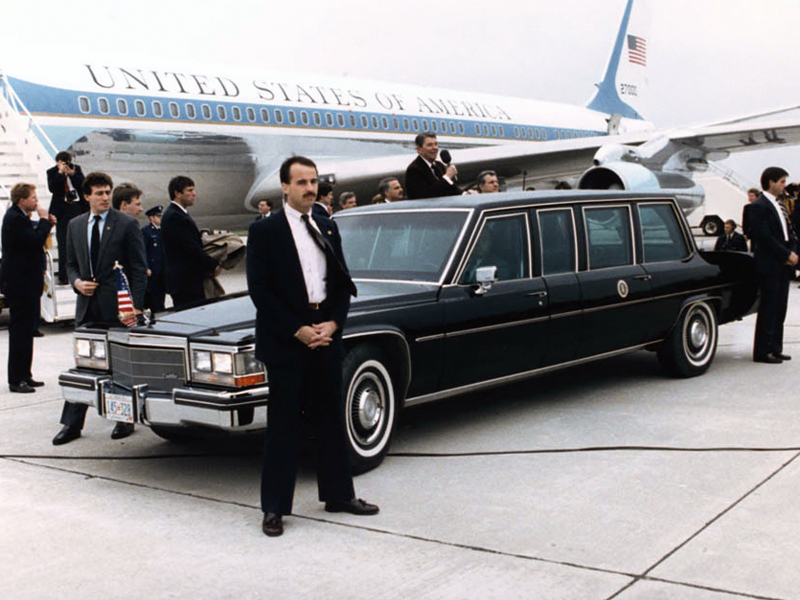
Locate an element on the screen. The height and width of the screenshot is (600, 800). window is located at coordinates (486, 246).